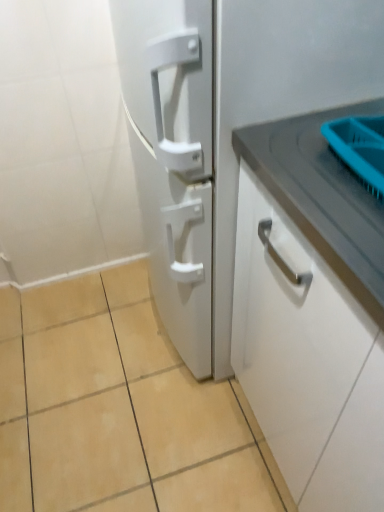
Question: Relative to white matte refrigerator at center, is white matte cabinet handle at right in front or behind?

Choices:
 (A) behind
 (B) front

Answer: (B)

Question: Does point (238, 322) appear closer or farther from the camera than point (321, 76)?

Choices:
 (A) closer
 (B) farther

Answer: (B)

Question: Which object is the closest to the white matte cabinet handle at right?

Choices:
 (A) beige ceramic tile at lower center
 (B) white matte refrigerator at center

Answer: (B)

Question: Which object is the closest to the white matte cabinet handle at right?

Choices:
 (A) beige ceramic tile at lower center
 (B) white matte refrigerator at center

Answer: (B)